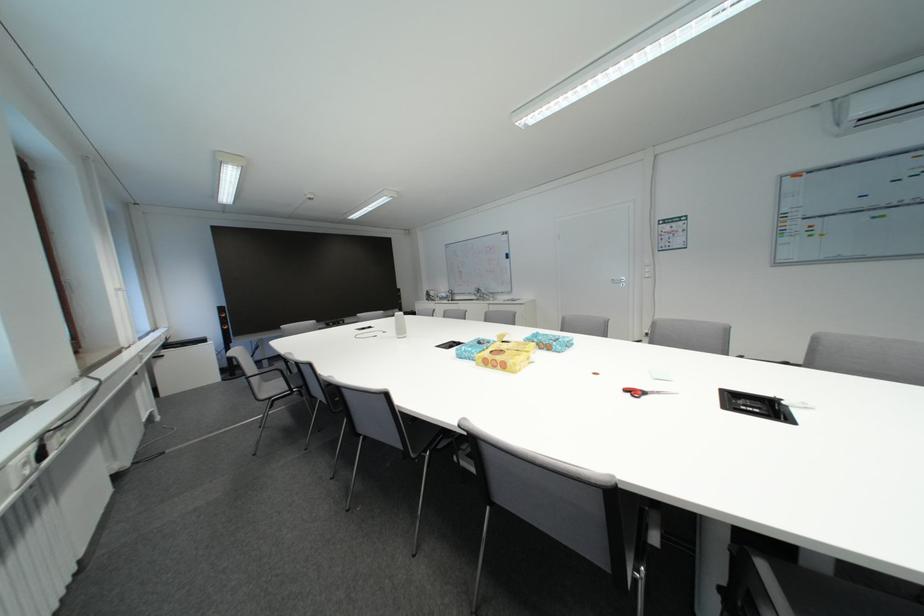
This screenshot has height=616, width=924. Find the location of `red scissors`. red scissors is located at coordinates (643, 392).